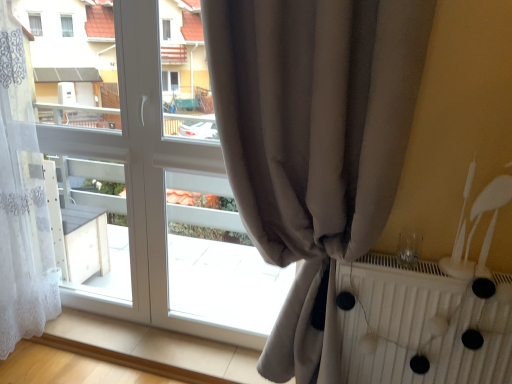
Question: Is satin beige curtain at center, which is the first curtain in right-to-left order, looking in the opposite direction of white textured radiator at right?

Choices:
 (A) yes
 (B) no

Answer: (B)

Question: Is satin beige curtain at center, which is the first curtain in right-to-left order, further to the viewer compared to white textured radiator at right?

Choices:
 (A) no
 (B) yes

Answer: (A)

Question: Does satin beige curtain at center, placed as the second curtain when sorted from left to right, have a larger size compared to white textured radiator at right?

Choices:
 (A) yes
 (B) no

Answer: (A)

Question: Considering the relative sizes of satin beige curtain at center, placed as the second curtain when sorted from left to right, and white textured radiator at right in the image provided, is satin beige curtain at center, placed as the second curtain when sorted from left to right, smaller than white textured radiator at right?

Choices:
 (A) yes
 (B) no

Answer: (B)

Question: Is satin beige curtain at center, which is the first curtain in right-to-left order, wider than white textured radiator at right?

Choices:
 (A) no
 (B) yes

Answer: (B)

Question: From the image's perspective, is satin beige curtain at center, which is the first curtain in right-to-left order, positioned above or below white textured radiator at right?

Choices:
 (A) above
 (B) below

Answer: (A)

Question: Looking at the image, does satin beige curtain at center, placed as the second curtain when sorted from left to right, seem bigger or smaller compared to white textured radiator at right?

Choices:
 (A) big
 (B) small

Answer: (A)

Question: From a real-world perspective, is satin beige curtain at center, placed as the second curtain when sorted from left to right, above or below white textured radiator at right?

Choices:
 (A) above
 (B) below

Answer: (A)

Question: Is satin beige curtain at center, placed as the second curtain when sorted from left to right, inside or outside of white textured radiator at right?

Choices:
 (A) outside
 (B) inside

Answer: (A)

Question: From the image's perspective, is white textured radiator at right positioned above or below satin beige curtain at center, placed as the second curtain when sorted from left to right?

Choices:
 (A) above
 (B) below

Answer: (B)

Question: Considering the positions of point (367, 261) and point (230, 1), is point (367, 261) closer or farther from the camera than point (230, 1)?

Choices:
 (A) closer
 (B) farther

Answer: (B)

Question: Considering their positions, is white textured radiator at right located in front of or behind satin beige curtain at center, placed as the second curtain when sorted from left to right?

Choices:
 (A) behind
 (B) front

Answer: (A)

Question: In terms of height, does white textured radiator at right look taller or shorter compared to satin beige curtain at center, which is the first curtain in right-to-left order?

Choices:
 (A) short
 (B) tall

Answer: (A)

Question: Based on their sizes in the image, would you say white sheer curtain at left, placed as the 2th curtain when sorted from right to left, is bigger or smaller than white textured radiator at right?

Choices:
 (A) big
 (B) small

Answer: (A)

Question: Choose the correct answer: Is white sheer curtain at left, which is counted as the 1th curtain, starting from the left, inside white textured radiator at right or outside it?

Choices:
 (A) outside
 (B) inside

Answer: (A)